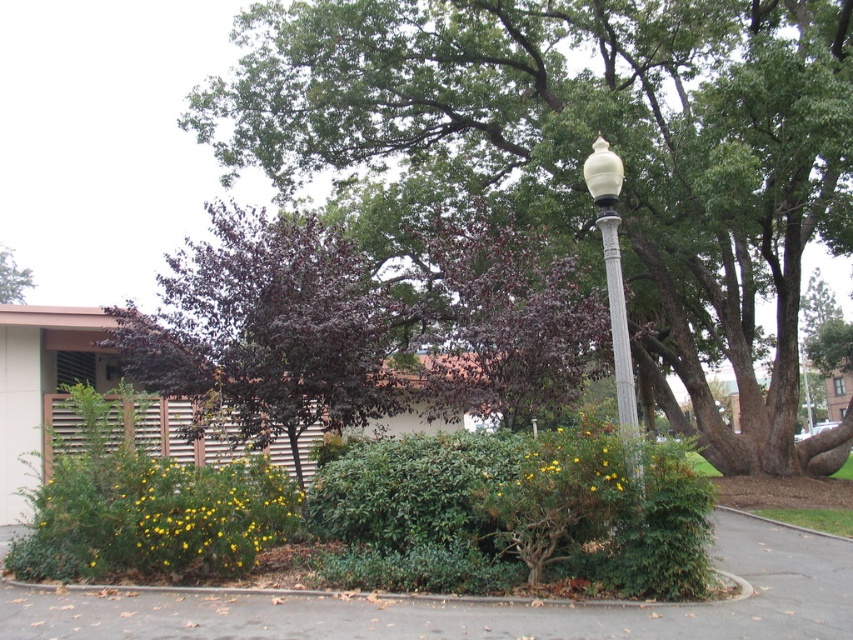
Locate an element on the screen. purple-leaved tree at center is located at coordinates (585, 152).

Is purple-leaved tree at center further to camera compared to white glossy pole at center?

Yes, it is.

The height and width of the screenshot is (640, 853). Find the location of `purple-leaved tree at center`. purple-leaved tree at center is located at coordinates (585, 152).

Can you confirm if green leafy bush at center is positioned below white glossy pole at center?

Yes.

Can you confirm if green leafy bush at center is thinner than white glossy pole at center?

Incorrect, green leafy bush at center's width is not less than white glossy pole at center's.

Does point (386, 525) come closer to viewer compared to point (618, 400)?

Yes, it is in front of point (618, 400).

Locate an element on the screen. The height and width of the screenshot is (640, 853). green leafy bush at center is located at coordinates (514, 515).

Can you confirm if green leafy bush at center is thinner than purple glossy tree at center?

Correct, green leafy bush at center's width is less than purple glossy tree at center's.

Between green leafy bush at center and purple glossy tree at center, which one appears on the right side from the viewer's perspective?

From the viewer's perspective, green leafy bush at center appears more on the right side.

I want to click on green leafy bush at center, so point(514,515).